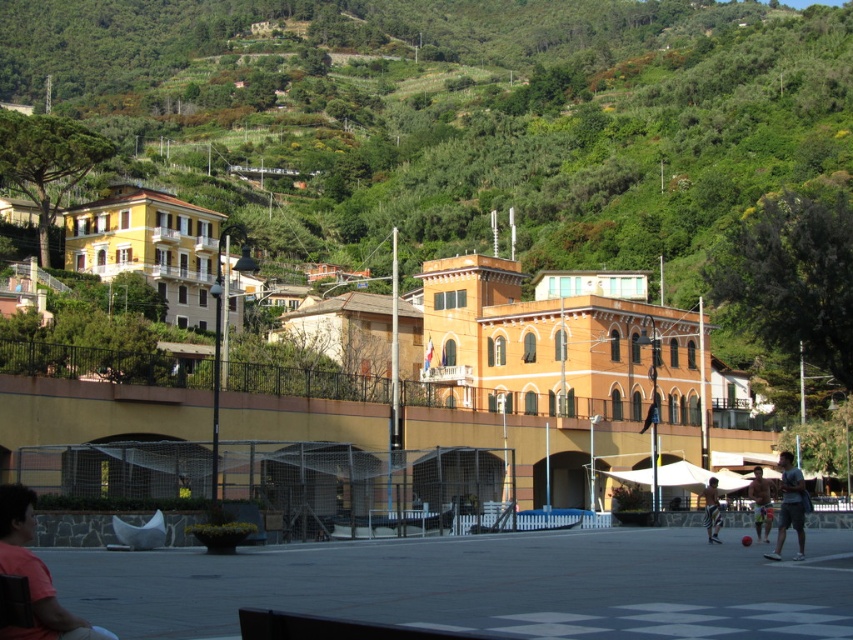
You are standing at the center of the plaza in the hillside town and notice a person wearing a matte pink shirt at lower left. Can you determine the exact coordinates of where this person is located relative to your position?

The matte pink shirt at lower left is located at point coordinates of (33, 573).